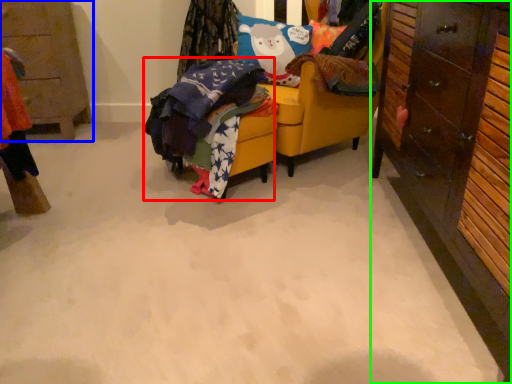
Question: Which object is the farthest from clothing (highlighted by a red box)? Choose among these: cabinetry (highlighted by a blue box) or cabinetry (highlighted by a green box).

Choices:
 (A) cabinetry
 (B) cabinetry

Answer: (A)